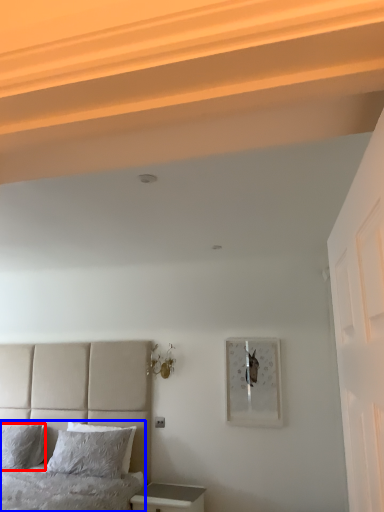
Question: Which point is further to the camera, pillow (highlighted by a red box) or bed (highlighted by a blue box)?

Choices:
 (A) pillow
 (B) bed

Answer: (A)